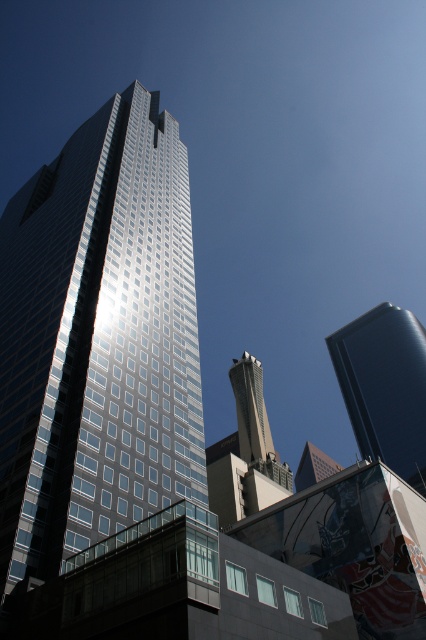
You are standing at the point with coordinates point (x=385, y=387) in the urban skyline. What building are you facing?

The point (x=385, y=387) indicates the glossy blue tower at right, so you are facing the glossy blue tower at right.

You are standing in the city square and see the glossy blue tower at right and the concrete tower at center. Which tower is positioned to the right of the other?

The glossy blue tower at right is positioned to the right of the concrete tower at center.

Looking at this image, you are standing in the city looking at the skyscrapers. There are two points marked on the buildings, point 1 at coordinates point (135,472) and point 2 at point (345,394). Which point is closer to you?

Point (135,472) is in front of point (345,394), so point (135,472) is closer to you.